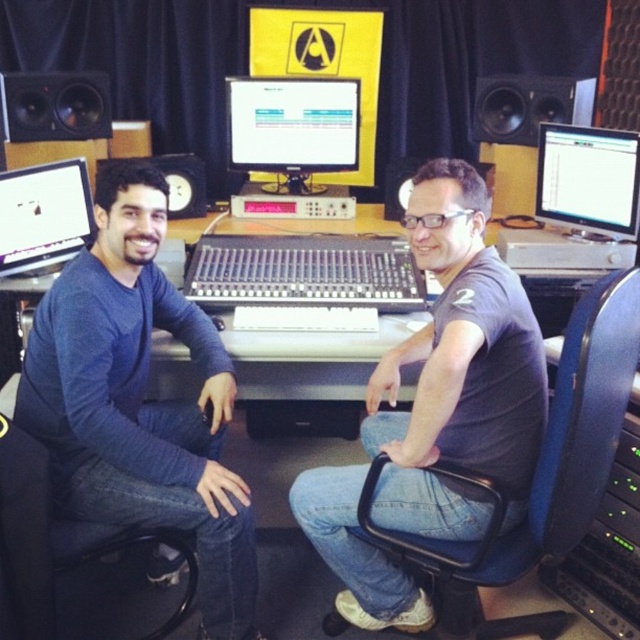
You are setting up a new sound system in the studio and need to place the matte black monitor at left and the black matte speaker at upper right. Given their sizes, which object should you allocate more space for?

The black matte speaker at upper right requires more space because it occupies more space than the matte black monitor at left.